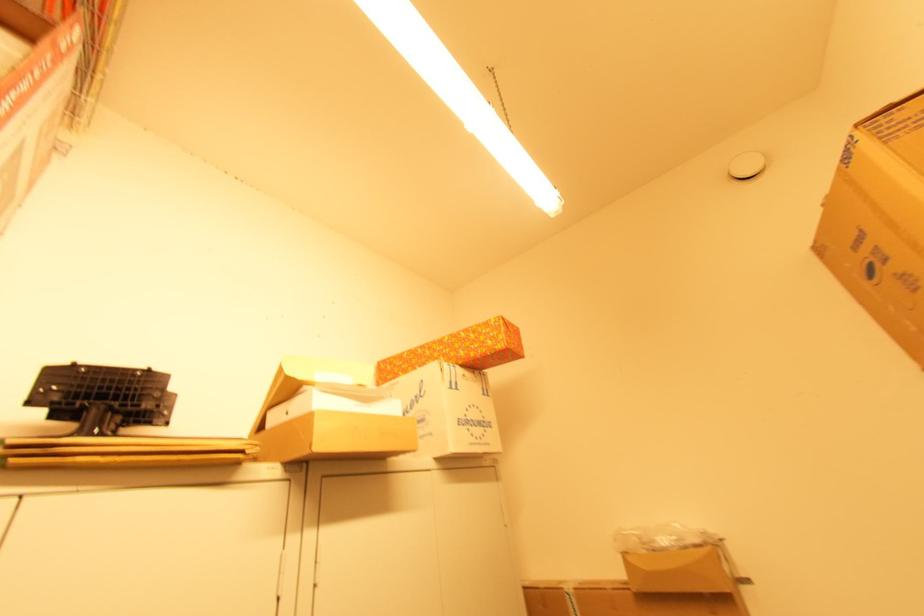
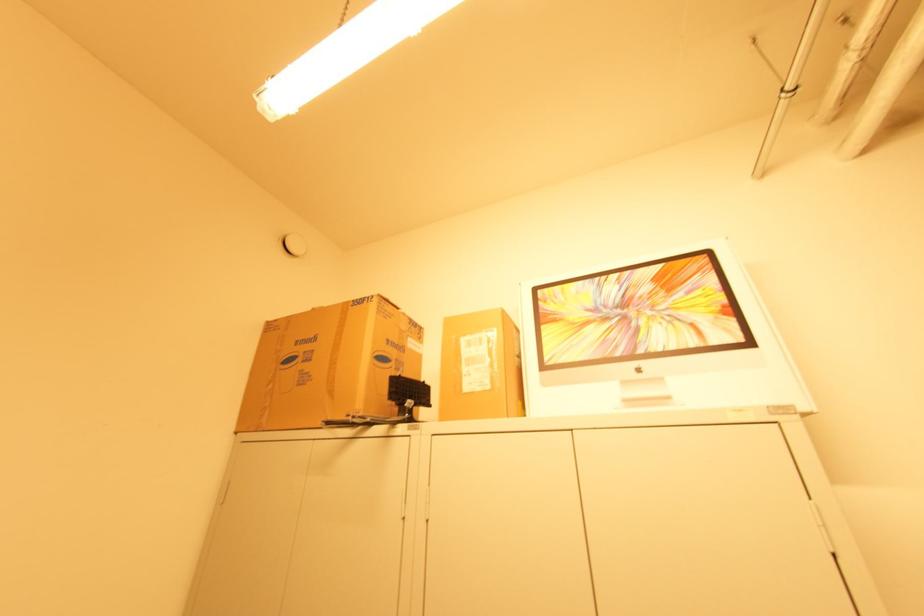
The images are taken continuously from a first-person perspective. In which direction is your viewpoint rotating?

The camera rotated toward right-up.